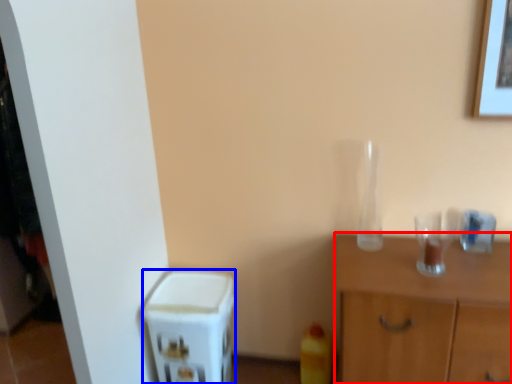
Question: Among these objects, which one is nearest to the camera, nightstand (highlighted by a red box) or appliance (highlighted by a blue box)?

Choices:
 (A) nightstand
 (B) appliance

Answer: (A)